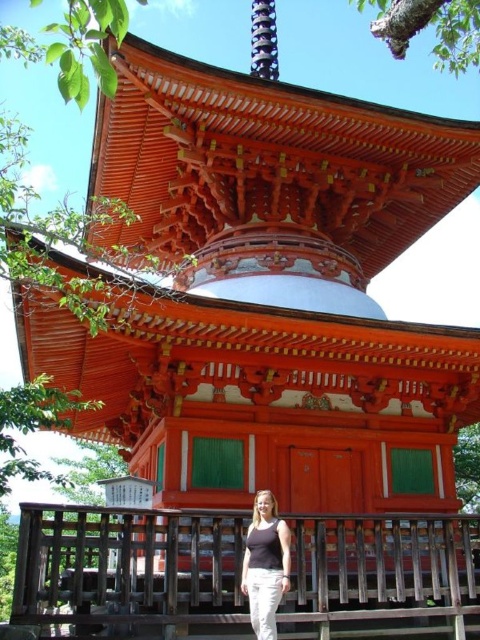
Does brown wooden rail at lower center appear on the right side of matte black tank top at center?

No, brown wooden rail at lower center is not to the right of matte black tank top at center.

Is brown wooden rail at lower center above matte black tank top at center?

Actually, brown wooden rail at lower center is below matte black tank top at center.

Is point (320, 545) positioned before point (263, 541)?

No, it is not.

Locate an element on the screen. This screenshot has width=480, height=640. brown wooden rail at lower center is located at coordinates (128, 566).